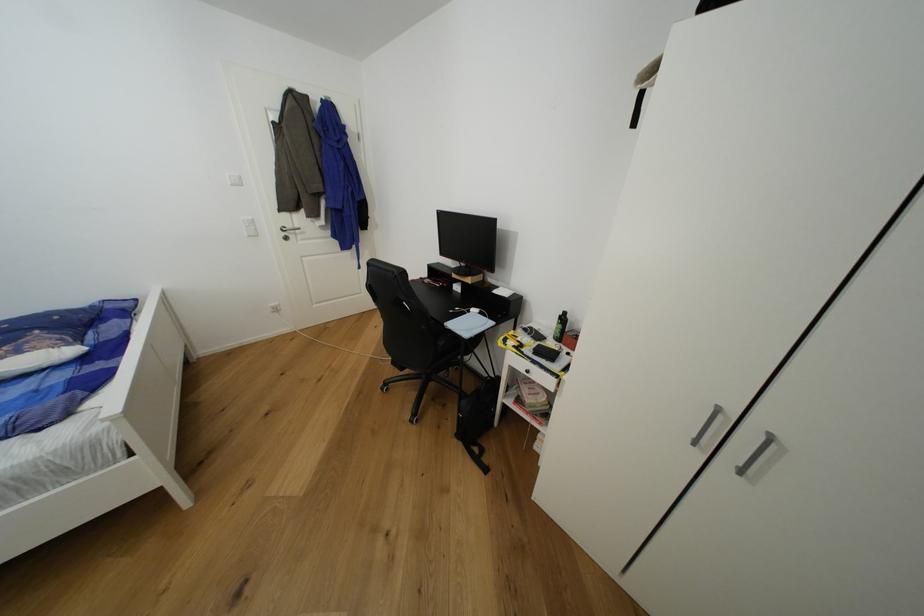
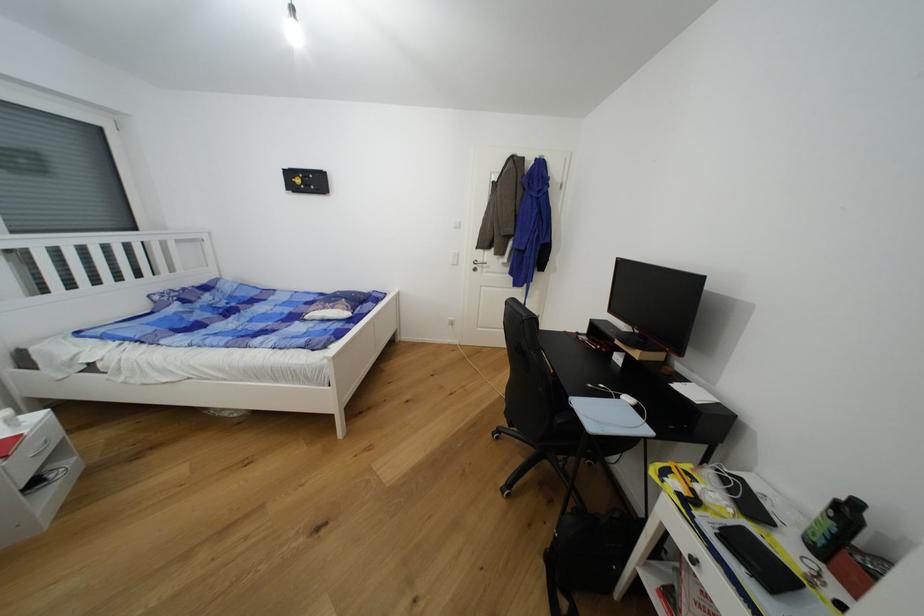
In the second image, find the point that corresponds to (475,313) in the first image.

(623, 399)